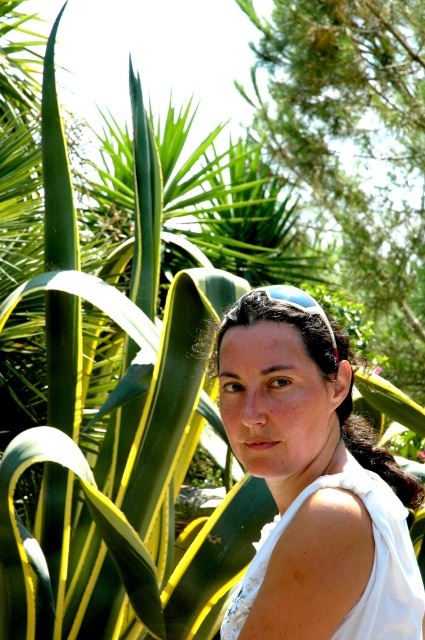
Describe the element at coordinates (314, 483) in the screenshot. I see `white fabric at center` at that location.

Does white fabric at center have a lesser width compared to white cotton dress at right?

Incorrect, white fabric at center's width is not less than white cotton dress at right's.

What do you see at coordinates (314, 483) in the screenshot? I see `white fabric at center` at bounding box center [314, 483].

Where is `white fabric at center`? This screenshot has width=425, height=640. white fabric at center is located at coordinates (314, 483).